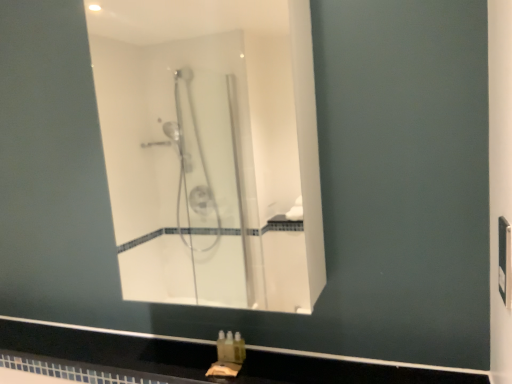
This screenshot has width=512, height=384. Identify the location of black glossy counter top at lower center. (187, 360).

Measure the distance between black glossy counter top at lower center and camera.

They are 37.39 inches apart.

At what (x,y) coordinates should I click in order to perform the action: click on clear glass shower at center. Please return your answer as a coordinate pair (x, y). This screenshot has width=512, height=384. Looking at the image, I should click on (211, 149).

From the image's perspective, is clear glass shower at center located beneath translucent plastic soap at lower center?

No, from the image's perspective, clear glass shower at center is not beneath translucent plastic soap at lower center.

Is clear glass shower at center closer to the viewer compared to translucent plastic soap at lower center?

Yes, clear glass shower at center is in front of translucent plastic soap at lower center.

How many degrees apart are the facing directions of clear glass shower at center and translucent plastic soap at lower center?

The angle between the facing direction of clear glass shower at center and the facing direction of translucent plastic soap at lower center is 1.79 degrees.

Does clear glass shower at center appear on the right side of translucent plastic soap at lower center?

In fact, clear glass shower at center is to the left of translucent plastic soap at lower center.

Which of these two, clear glass shower at center or black glossy counter top at lower center, is wider?

Wider between the two is black glossy counter top at lower center.

Is clear glass shower at center taller than black glossy counter top at lower center?

Correct, clear glass shower at center is much taller as black glossy counter top at lower center.

From a real-world perspective, relative to black glossy counter top at lower center, is clear glass shower at center vertically above or below?

Clearly, from a real-world perspective, clear glass shower at center is above black glossy counter top at lower center.

Could you tell me if clear glass shower at center is turned towards black glossy counter top at lower center?

No, clear glass shower at center is not turned towards black glossy counter top at lower center.

Considering the positions of points (241, 356) and (212, 304), is point (241, 356) farther from camera compared to point (212, 304)?

No.

Considering the relative sizes of translucent plastic soap at lower center and clear glass shower at center in the image provided, is translucent plastic soap at lower center shorter than clear glass shower at center?

Yes, translucent plastic soap at lower center is shorter than clear glass shower at center.

Is clear glass shower at center surrounded by translucent plastic soap at lower center?

Definitely not — clear glass shower at center is not inside translucent plastic soap at lower center.

From the image's perspective, which one is positioned higher, translucent plastic soap at lower center or clear glass shower at center?

clear glass shower at center is shown above in the image.

Could you tell me if black glossy counter top at lower center is facing clear glass shower at center?

No, black glossy counter top at lower center is not turned towards clear glass shower at center.

Between black glossy counter top at lower center and clear glass shower at center, which one appears on the left side from the viewer's perspective?

Positioned to the left is black glossy counter top at lower center.

Is black glossy counter top at lower center closer to the viewer compared to clear glass shower at center?

Yes, it is.

Between black glossy counter top at lower center and clear glass shower at center, which one has more height?

With more height is clear glass shower at center.

Is black glossy counter top at lower center shorter than translucent plastic soap at lower center?

Correct, black glossy counter top at lower center is not as tall as translucent plastic soap at lower center.

Which is farther from the camera, (177, 380) or (243, 355)?

The point (243, 355) is farther from the camera.

Are black glossy counter top at lower center and translucent plastic soap at lower center far apart?

Actually, black glossy counter top at lower center and translucent plastic soap at lower center are a little close together.

Is black glossy counter top at lower center spatially inside translucent plastic soap at lower center, or outside of it?

black glossy counter top at lower center is spatially situated outside translucent plastic soap at lower center.

How many degrees apart are the facing directions of translucent plastic soap at lower center and black glossy counter top at lower center?

There is a 0.298-degree angle between the facing directions of translucent plastic soap at lower center and black glossy counter top at lower center.

Is the depth of translucent plastic soap at lower center less than that of black glossy counter top at lower center?

No, translucent plastic soap at lower center is further to the viewer.

Is translucent plastic soap at lower center turned away from black glossy counter top at lower center?

No.

You are a GUI agent. You are given a task and a screenshot of the screen. Output one action in this format:
    pyautogui.click(x=<x>, y=<y>)
    Task: Click on the sink behind the black glossy counter top at lower center
    Image resolution: width=512 pixels, height=384 pixels.
    Given the screenshot: What is the action you would take?
    pyautogui.click(x=228, y=355)

What are the coordinates of `mirror lying above the translucent plastic soap at lower center (from the image's perspective)` in the screenshot? It's located at (211, 149).

Locate an element on the screen. Image resolution: width=512 pixels, height=384 pixels. mirror that appears above the black glossy counter top at lower center (from a real-world perspective) is located at coordinates (211, 149).

Estimate the real-world distances between objects in this image. Which object is closer to clear glass shower at center, translucent plastic soap at lower center or black glossy counter top at lower center?

black glossy counter top at lower center is positioned closer to the anchor clear glass shower at center.

Based on their spatial positions, is black glossy counter top at lower center or clear glass shower at center further from translucent plastic soap at lower center?

clear glass shower at center.

Based on their spatial positions, is translucent plastic soap at lower center or clear glass shower at center closer to black glossy counter top at lower center?

Based on the image, translucent plastic soap at lower center appears to be nearer to black glossy counter top at lower center.

When comparing their distances from clear glass shower at center, does black glossy counter top at lower center or translucent plastic soap at lower center seem further?

translucent plastic soap at lower center is further to clear glass shower at center.

Estimate the real-world distances between objects in this image. Which object is further from translucent plastic soap at lower center, clear glass shower at center or black glossy counter top at lower center?

clear glass shower at center.

Looking at the image, which one is located further to black glossy counter top at lower center, clear glass shower at center or translucent plastic soap at lower center?

Among the two, clear glass shower at center is located further to black glossy counter top at lower center.

In order to click on sink that lies between clear glass shower at center and black glossy counter top at lower center from top to bottom in this screenshot , I will do `click(228, 355)`.